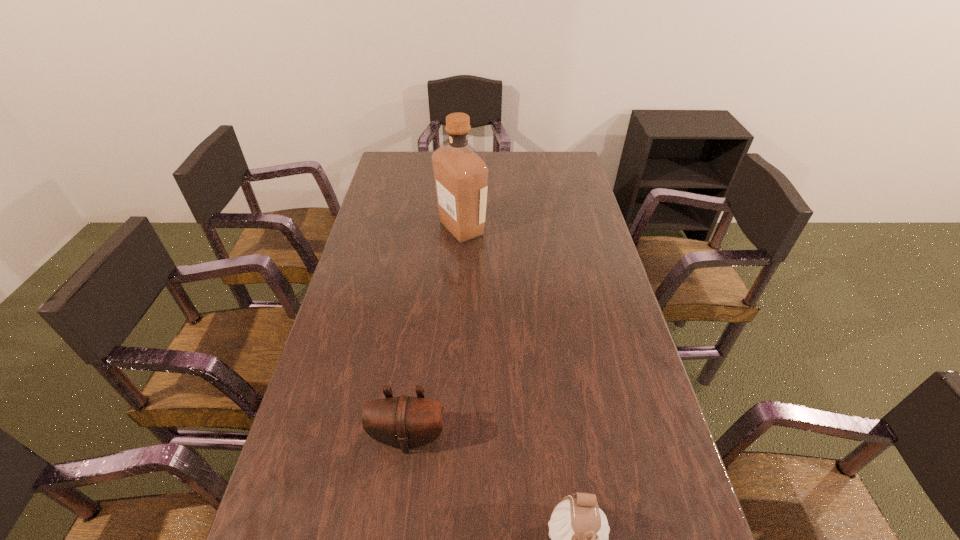
The width and height of the screenshot is (960, 540). I want to click on free space between the second nearest object and the tallest object, so click(x=435, y=333).

Select which object is the second closest to the nearest object. Please provide its 2D coordinates. Your answer should be formatted as a tuple, i.e. [(x, y)], where the tuple contains the x and y coordinates of a point satisfying the conditions above.

[(460, 175)]

I want to click on object that ranks as the closest to the right pouch, so click(405, 422).

Where is `vacant space that satisfies the following two spatial constraints: 1. on the front-facing side of the liquor; 2. with the flap open on the farther pouch`? vacant space that satisfies the following two spatial constraints: 1. on the front-facing side of the liquor; 2. with the flap open on the farther pouch is located at coordinates click(x=451, y=437).

I want to click on free location that satisfies the following two spatial constraints: 1. on the front-facing side of the liquor; 2. with the flap open on the second farthest object, so click(x=451, y=437).